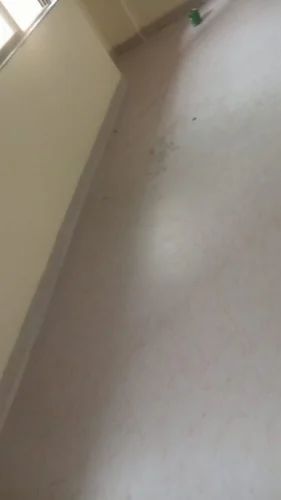
Where is `wall`? The height and width of the screenshot is (500, 281). wall is located at coordinates (15, 169), (68, 77).